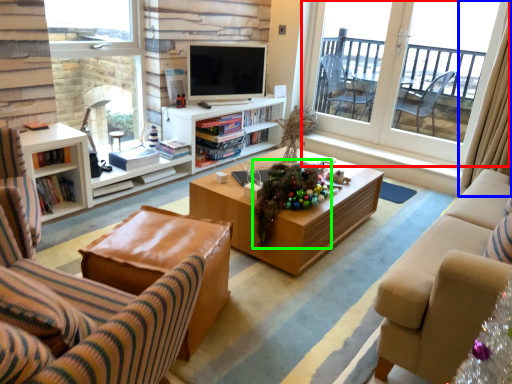
Question: Considering the real-world distances, which object is farthest from window (highlighted by a red box)? curtain (highlighted by a blue box) or christmas decoration (highlighted by a green box)?

Choices:
 (A) curtain
 (B) christmas decoration

Answer: (B)